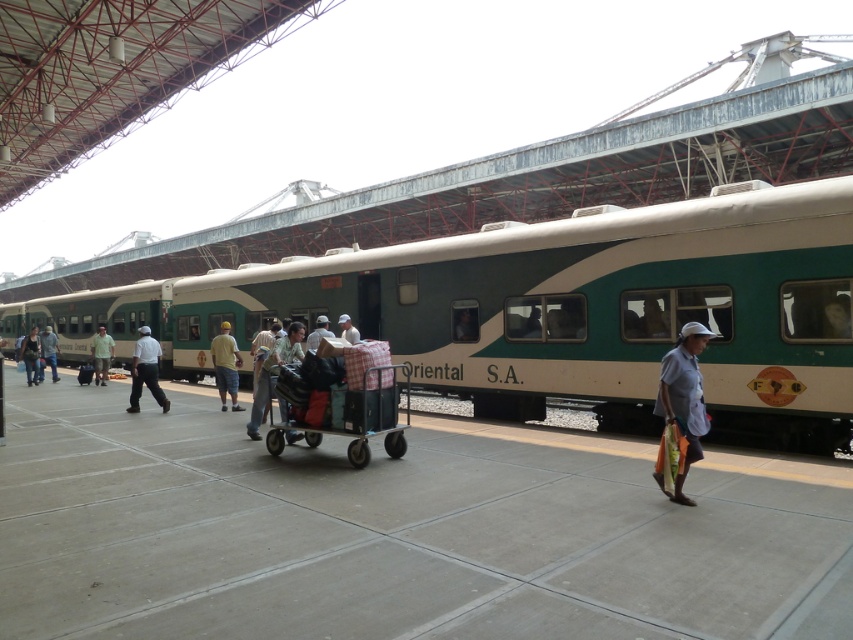
You are a passenger at the train station and see the plastic luggage cart at center and the light blue shirt at left. Which object is closer to the train?

The plastic luggage cart at center is positioned under light blue shirt at left, so the plastic luggage cart at center is closer to the train than the light blue shirt at left.